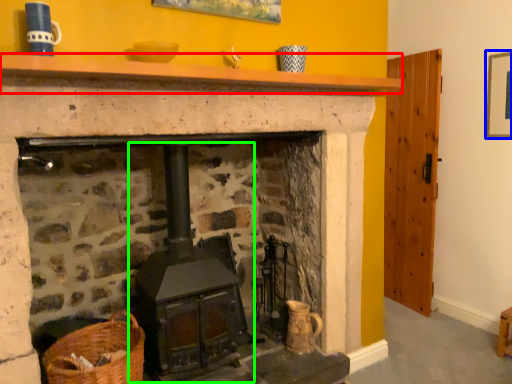
Question: Based on their relative distances, which object is farther from mantle (highlighted by a red box)? Choose from picture frame (highlighted by a blue box) and stove (highlighted by a green box).

Choices:
 (A) picture frame
 (B) stove

Answer: (A)